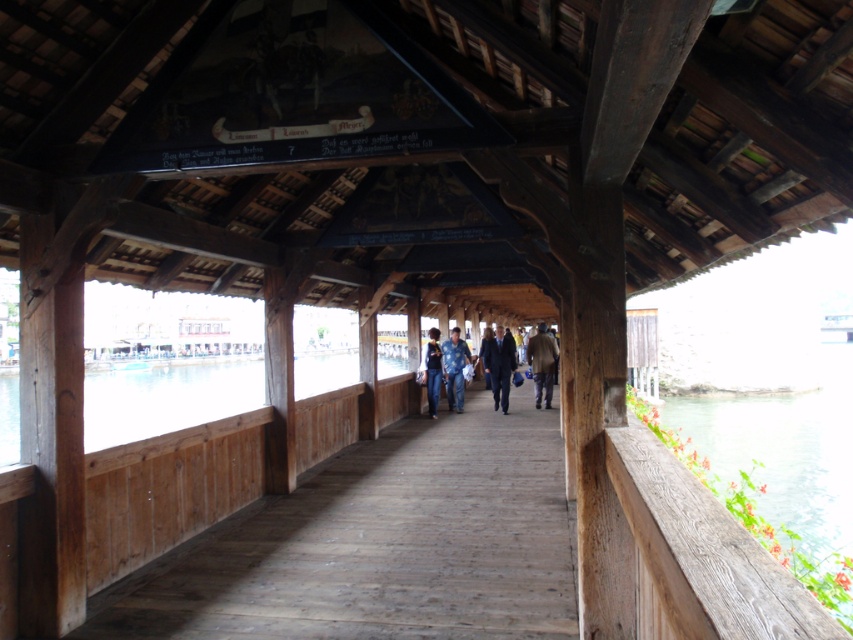
Between point (509, 372) and point (434, 332), which one is positioned in front?

Point (434, 332)

Identify the location of dark blue suit at center. Image resolution: width=853 pixels, height=640 pixels. (498, 365).

Which of these two, green wooden railing at right or brown leather jacket at center, stands shorter?

Standing shorter between the two is brown leather jacket at center.

Who is more forward, (799, 540) or (538, 360)?

Positioned in front is point (799, 540).

At what (x,y) coordinates should I click in order to perform the action: click on green wooden railing at right. Please return your answer as a coordinate pair (x, y). Image resolution: width=853 pixels, height=640 pixels. Looking at the image, I should click on (764, 467).

The height and width of the screenshot is (640, 853). I want to click on green wooden railing at right, so click(764, 467).

Between blue jeans at center and blue denim jeans at center, which one has less height?

With less height is blue jeans at center.

Between blue jeans at center and blue denim jeans at center, which one is positioned lower?

blue jeans at center

Identify the location of blue jeans at center. (454, 369).